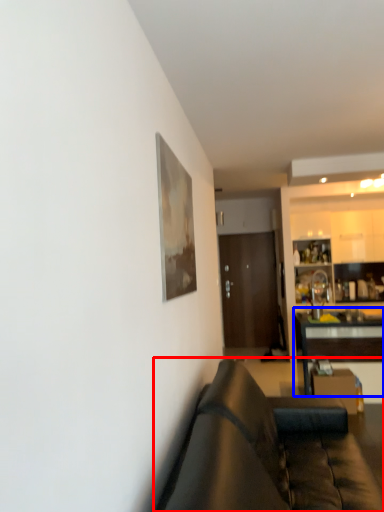
Question: Which object appears farthest to the camera in this image, studio couch (highlighted by a red box) or table (highlighted by a blue box)?

Choices:
 (A) studio couch
 (B) table

Answer: (B)